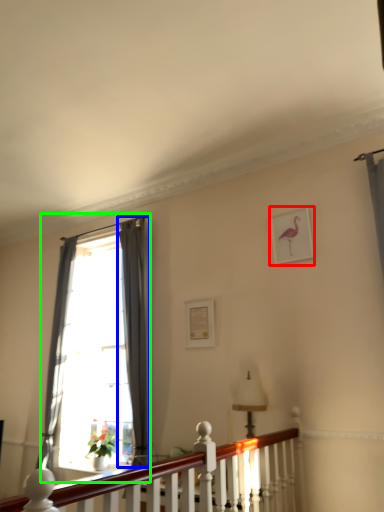
Question: Estimate the real-world distances between objects in this image. Which object is farther from picture frame (highlighted by a red box), curtain (highlighted by a blue box) or window (highlighted by a green box)?

Choices:
 (A) curtain
 (B) window

Answer: (B)